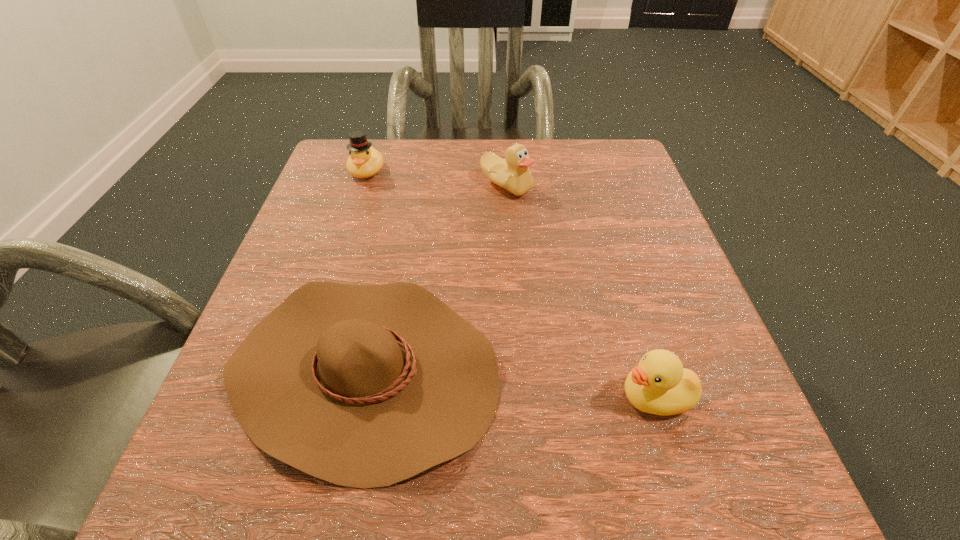
The width and height of the screenshot is (960, 540). I want to click on vacant region at the far left corner, so click(x=398, y=151).

The height and width of the screenshot is (540, 960). In the image, there is a desktop. Find the location of `free space at the near left corner`. free space at the near left corner is located at coordinates (253, 457).

This screenshot has height=540, width=960. I want to click on vacant area at the far right corner, so click(x=584, y=161).

Find the location of `free point at the near right corner`. free point at the near right corner is located at coordinates (693, 478).

Identify the location of free spot between the nearest duck and the leftmost duck. This screenshot has width=960, height=540. (511, 284).

This screenshot has height=540, width=960. I want to click on free space that is in between the cowboy hat and the rightmost duck, so click(510, 383).

Find the location of a particular element. blank region between the leftmost duck and the rightmost duck is located at coordinates tap(511, 284).

At what (x,y) coordinates should I click in order to perform the action: click on free space between the cowboy hat and the second duck from right to left. Please return your answer as a coordinate pair (x, y). Looking at the image, I should click on (435, 278).

The width and height of the screenshot is (960, 540). Find the location of `free spot between the second duck from left to right and the shortest object`. free spot between the second duck from left to right and the shortest object is located at coordinates (435, 278).

At what (x,y) coordinates should I click in order to perform the action: click on free spot between the second duck from left to right and the leftmost duck. Please return your answer as a coordinate pair (x, y). Looking at the image, I should click on (437, 178).